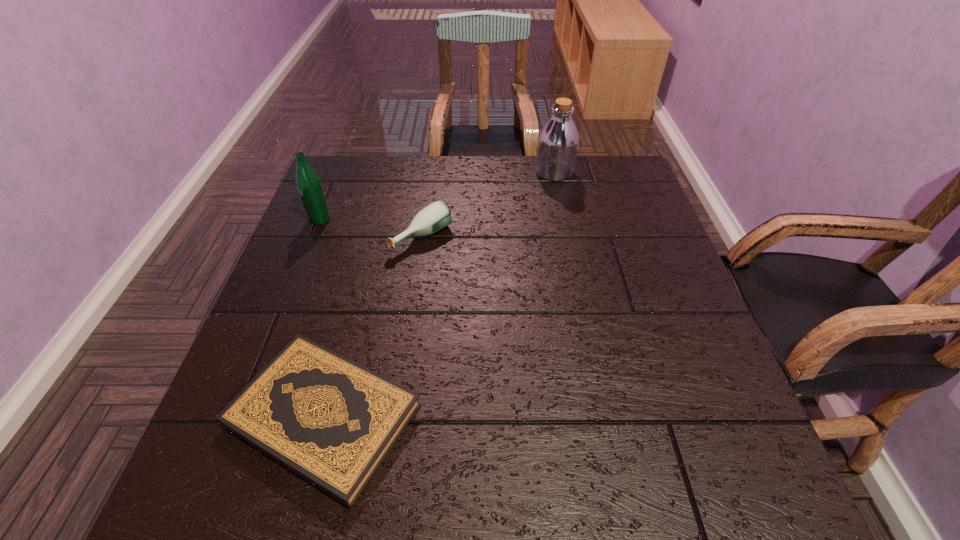
The image size is (960, 540). I want to click on the farthest object, so click(x=558, y=140).

Where is `the rightmost object`? the rightmost object is located at coordinates (558, 140).

At what (x,y) coordinates should I click in order to perform the action: click on the leftmost bottle. Please return your answer as a coordinate pair (x, y). The image size is (960, 540). Looking at the image, I should click on (308, 183).

Where is `the second bottle from left to right`? This screenshot has height=540, width=960. the second bottle from left to right is located at coordinates (437, 215).

The image size is (960, 540). I want to click on the shortest bottle, so click(x=437, y=215).

The image size is (960, 540). Find the location of `hardback book`. hardback book is located at coordinates (331, 421).

In order to click on the shortest object in this screenshot , I will do `click(331, 421)`.

Find the location of a particular element. The image size is (960, 540). free location located 0.310m on the left of the rightmost bottle is located at coordinates (429, 172).

The height and width of the screenshot is (540, 960). I want to click on free space located 0.130m on the front of the leftmost bottle, so click(303, 261).

Image resolution: width=960 pixels, height=540 pixels. I want to click on free region located 0.280m on the front of the second bottle from right to left, so click(404, 360).